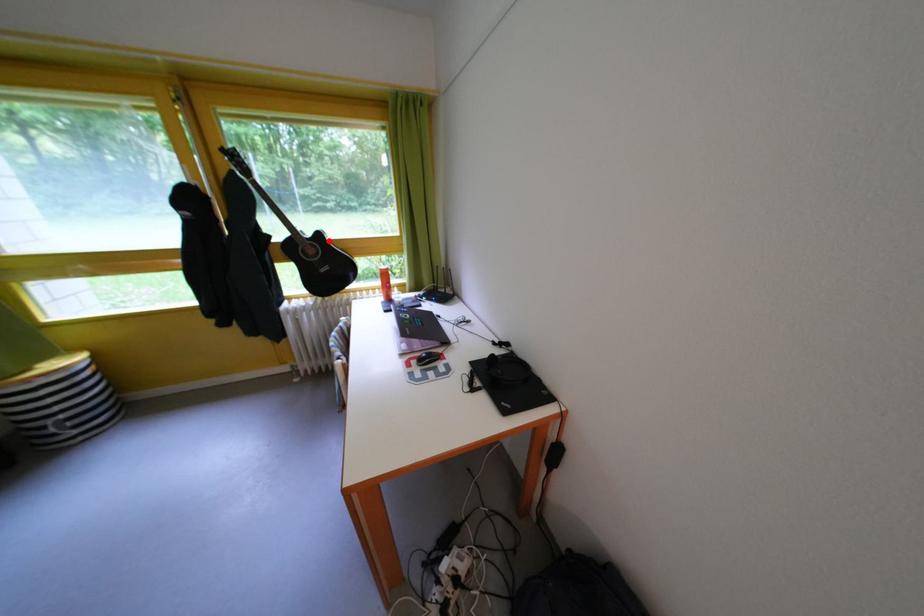
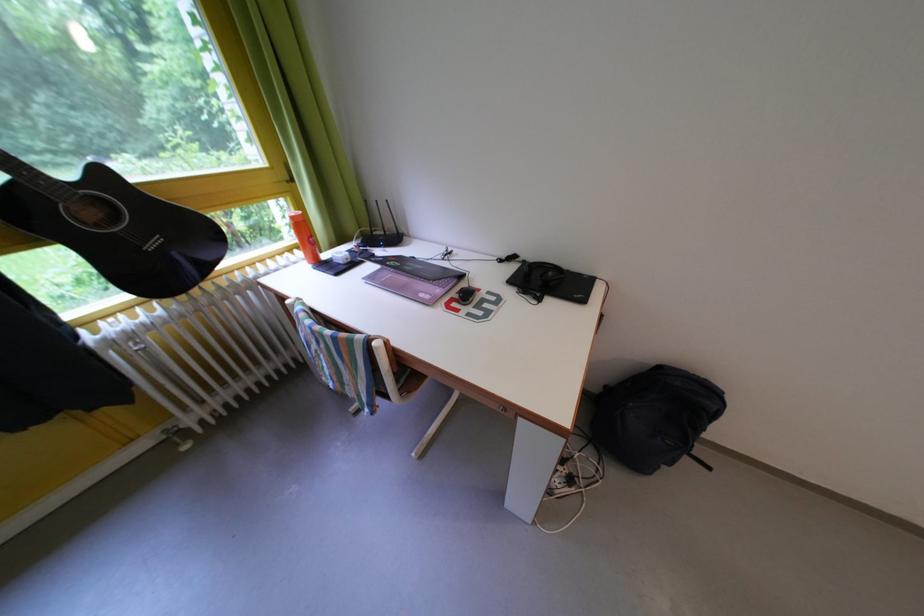
In the second image, find the point that corresponds to the highlighted location in the first image.

(112, 179)